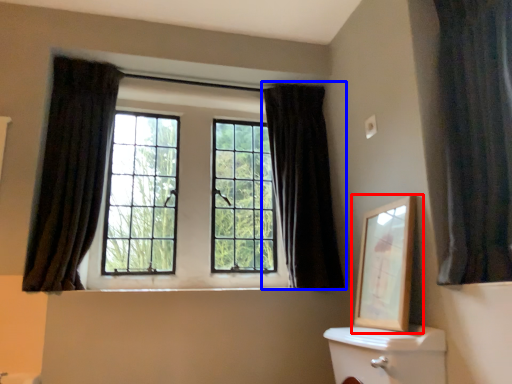
Question: Which object is closer to the camera taking this photo, picture frame (highlighted by a red box) or curtain (highlighted by a blue box)?

Choices:
 (A) picture frame
 (B) curtain

Answer: (A)